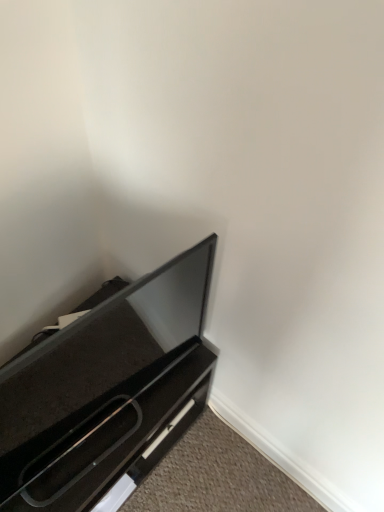
You are a GUI agent. You are given a task and a screenshot of the screen. Output one action in this format:
    pyautogui.click(x=<x>, y=<y>)
    Task: Click on the vacant area situated below black glossy tv stand at lower left (from a real-world perspective)
    The width and height of the screenshot is (384, 512).
    Given the screenshot: What is the action you would take?
    pyautogui.click(x=126, y=417)